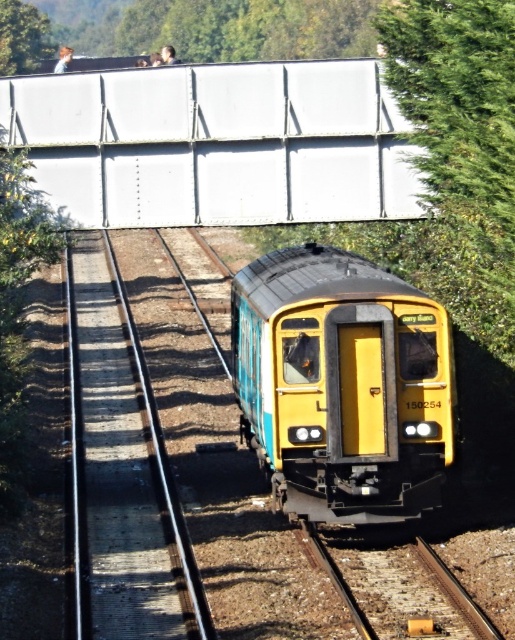
Question: Is green leafy tree at upper center above metal/rough train track at lower center?

Choices:
 (A) yes
 (B) no

Answer: (A)

Question: Which point is closer to the camera taking this photo?

Choices:
 (A) (121, 35)
 (B) (7, 72)

Answer: (B)

Question: Does smooth concrete train track at center appear on the left side of green leafy tree at upper center?

Choices:
 (A) no
 (B) yes

Answer: (B)

Question: Based on their relative distances, which object is nearer to the metal/rough train track at lower center?

Choices:
 (A) yellow matte train at center
 (B) green leafy tree at upper center

Answer: (A)

Question: Which object appears farthest from the camera in this image?

Choices:
 (A) yellow matte train at center
 (B) green leafy tree at upper left
 (C) green leafy tree at upper center
 (D) metal/rough train track at lower center

Answer: (C)

Question: Does yellow matte train at center have a larger size compared to green leafy tree at upper center?

Choices:
 (A) no
 (B) yes

Answer: (A)